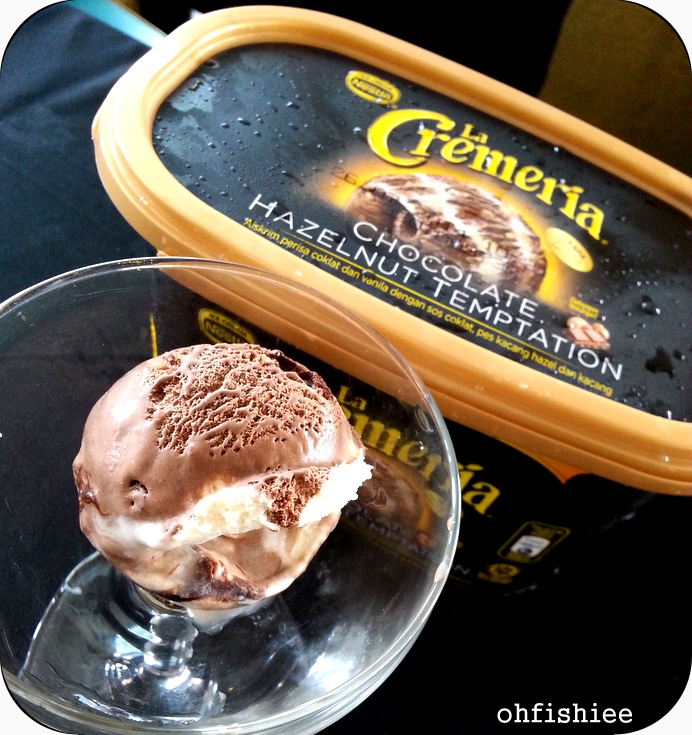
Locate an element on the screen. This screenshot has width=692, height=735. glass bowl is located at coordinates (398, 564).